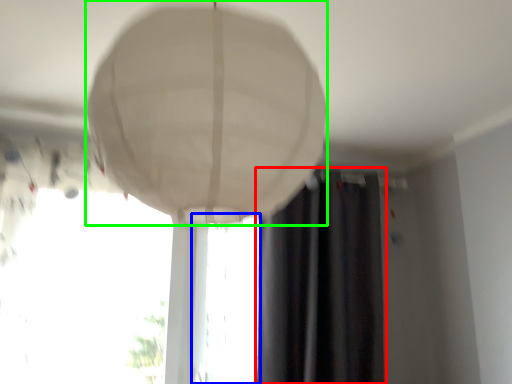
Question: Which object is positioned closest to curtain (highlighted by a red box)? Select from window (highlighted by a blue box) and lamp (highlighted by a green box).

Choices:
 (A) window
 (B) lamp

Answer: (A)